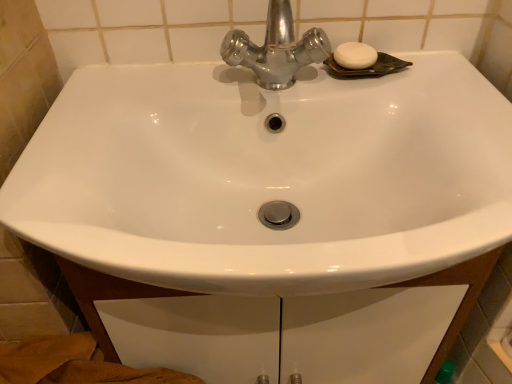
Identify the location of white matte soap at upper right. Image resolution: width=512 pixels, height=384 pixels. click(x=355, y=56).

The height and width of the screenshot is (384, 512). Describe the element at coordinates (355, 56) in the screenshot. I see `white matte soap at upper right` at that location.

This screenshot has width=512, height=384. Find the location of `shiny metallic faucet at upper center`. shiny metallic faucet at upper center is located at coordinates (276, 49).

This screenshot has width=512, height=384. What do you see at coordinates (276, 49) in the screenshot?
I see `shiny metallic faucet at upper center` at bounding box center [276, 49].

The height and width of the screenshot is (384, 512). What are the coordinates of `white matte soap at upper right` in the screenshot? It's located at (355, 56).

Is white matte soap at upper right at the right side of shiny metallic faucet at upper center?

Correct, you'll find white matte soap at upper right to the right of shiny metallic faucet at upper center.

Between white matte soap at upper right and shiny metallic faucet at upper center, which one is positioned in front?

shiny metallic faucet at upper center is in front.

Is point (348, 44) behind point (250, 59)?

Yes, point (348, 44) is behind point (250, 59).

Consider the image. From the image's perspective, which is above, white matte soap at upper right or shiny metallic faucet at upper center?

white matte soap at upper right appears higher in the image.

From a real-world perspective, between white matte soap at upper right and shiny metallic faucet at upper center, who is vertically lower?

white matte soap at upper right is physically lower.

Does white matte soap at upper right have a lesser width compared to shiny metallic faucet at upper center?

Indeed, white matte soap at upper right has a lesser width compared to shiny metallic faucet at upper center.

Considering the sizes of objects white matte soap at upper right and shiny metallic faucet at upper center in the image provided, who is taller, white matte soap at upper right or shiny metallic faucet at upper center?

With more height is shiny metallic faucet at upper center.

Can you confirm if white matte soap at upper right is bigger than shiny metallic faucet at upper center?

No.

Choose the correct answer: Is white matte soap at upper right inside shiny metallic faucet at upper center or outside it?

white matte soap at upper right lies outside shiny metallic faucet at upper center.

Is white matte soap at upper right placed right next to shiny metallic faucet at upper center?

No, white matte soap at upper right is not beside shiny metallic faucet at upper center.

Is white matte soap at upper right aimed at shiny metallic faucet at upper center?

No, white matte soap at upper right is not turned towards shiny metallic faucet at upper center.

How many degrees apart are the facing directions of white matte soap at upper right and shiny metallic faucet at upper center?

The angular difference between white matte soap at upper right and shiny metallic faucet at upper center is 0.000315 degrees.

Measure the distance between white matte soap at upper right and shiny metallic faucet at upper center.

white matte soap at upper right and shiny metallic faucet at upper center are 10.42 centimeters apart.

This screenshot has width=512, height=384. Identify the location of tap in front of the white matte soap at upper right. tap(276, 49).

Is shiny metallic faucet at upper center to the left of white matte soap at upper right from the viewer's perspective?

Correct, you'll find shiny metallic faucet at upper center to the left of white matte soap at upper right.

Which object is more forward, shiny metallic faucet at upper center or white matte soap at upper right?

shiny metallic faucet at upper center is in front.

Between point (307, 48) and point (348, 42), which one is positioned in front?

The point (307, 48) is closer to the camera.

From the image's perspective, is shiny metallic faucet at upper center under white matte soap at upper right?

Yes, from the image's perspective, shiny metallic faucet at upper center is below white matte soap at upper right.

From a real-world perspective, which object rests below the other?

From a 3D spatial view, white matte soap at upper right is below.

Which object is thinner, shiny metallic faucet at upper center or white matte soap at upper right?

With smaller width is white matte soap at upper right.

Who is shorter, shiny metallic faucet at upper center or white matte soap at upper right?

white matte soap at upper right.

Who is bigger, shiny metallic faucet at upper center or white matte soap at upper right?

Bigger between the two is shiny metallic faucet at upper center.

Do you think shiny metallic faucet at upper center is within white matte soap at upper right, or outside of it?

shiny metallic faucet at upper center is located beyond the bounds of white matte soap at upper right.

Can you see shiny metallic faucet at upper center touching white matte soap at upper right?

No, shiny metallic faucet at upper center is not touching white matte soap at upper right.

Is shiny metallic faucet at upper center positioned with its back to white matte soap at upper right?

shiny metallic faucet at upper center is not turned away from white matte soap at upper right.

Find the location of a particular element. The width and height of the screenshot is (512, 384). soap below the shiny metallic faucet at upper center (from a real-world perspective) is located at coordinates (355, 56).

You are a GUI agent. You are given a task and a screenshot of the screen. Output one action in this format:
    pyautogui.click(x=<x>, y=<y>)
    Task: Click on the tap below the white matte soap at upper right (from the image's perspective)
    This screenshot has height=384, width=512.
    Given the screenshot: What is the action you would take?
    pyautogui.click(x=276, y=49)

You are a GUI agent. You are given a task and a screenshot of the screen. Output one action in this format:
    pyautogui.click(x=<x>, y=<y>)
    Task: Click on the soap behind the shiny metallic faucet at upper center
    The image size is (512, 384).
    Given the screenshot: What is the action you would take?
    pyautogui.click(x=355, y=56)